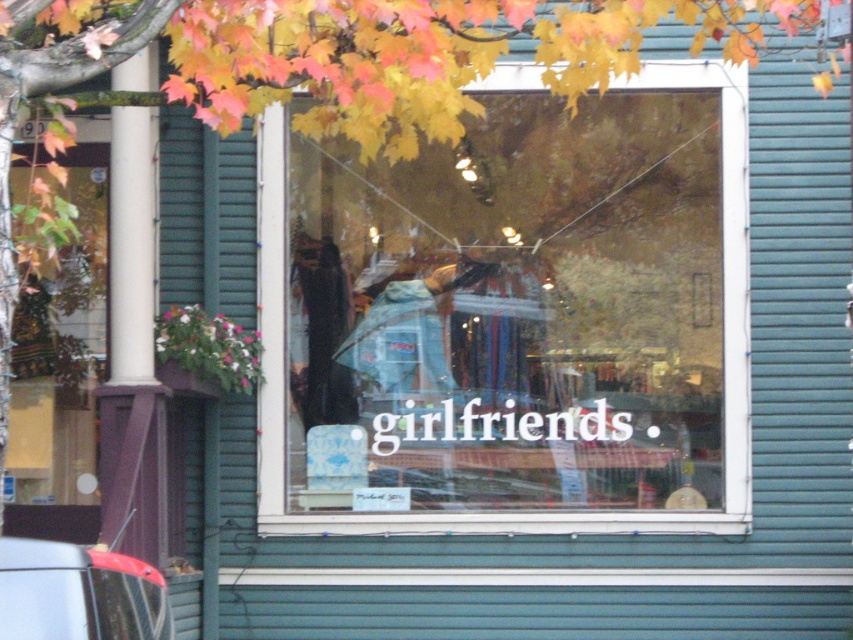
Question: Which point is farther to the camera?

Choices:
 (A) transparent glass window at center
 (B) metallic gray car at lower left

Answer: (A)

Question: Does transparent glass window at center appear under metallic gray car at lower left?

Choices:
 (A) no
 (B) yes

Answer: (A)

Question: Is transparent glass window at center smaller than metallic gray car at lower left?

Choices:
 (A) no
 (B) yes

Answer: (A)

Question: Is transparent glass window at center wider than metallic gray car at lower left?

Choices:
 (A) yes
 (B) no

Answer: (A)

Question: Which point is farther to the camera?

Choices:
 (A) metallic gray car at lower left
 (B) transparent glass window at center

Answer: (B)

Question: Which object is farther from the camera taking this photo?

Choices:
 (A) metallic gray car at lower left
 (B) transparent glass window at center

Answer: (B)